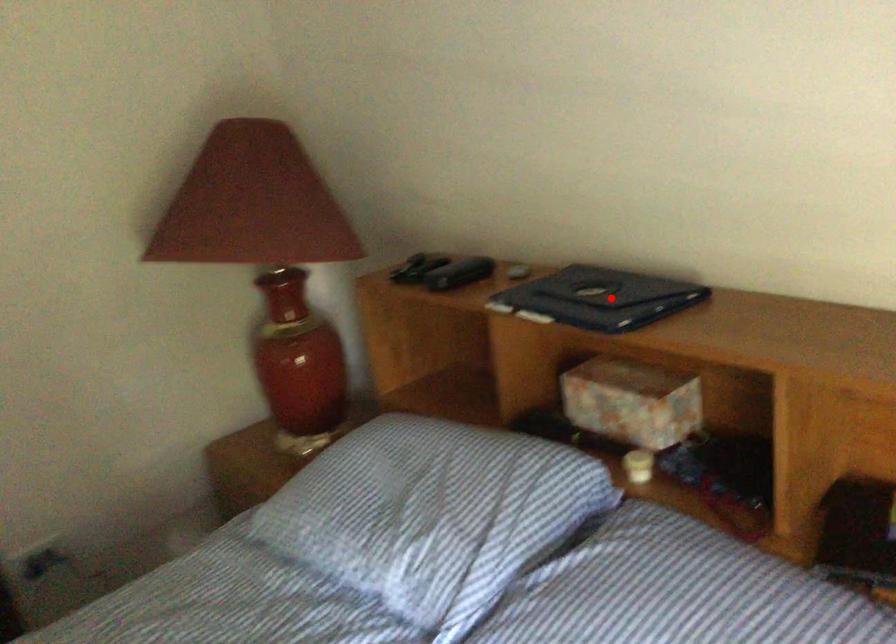
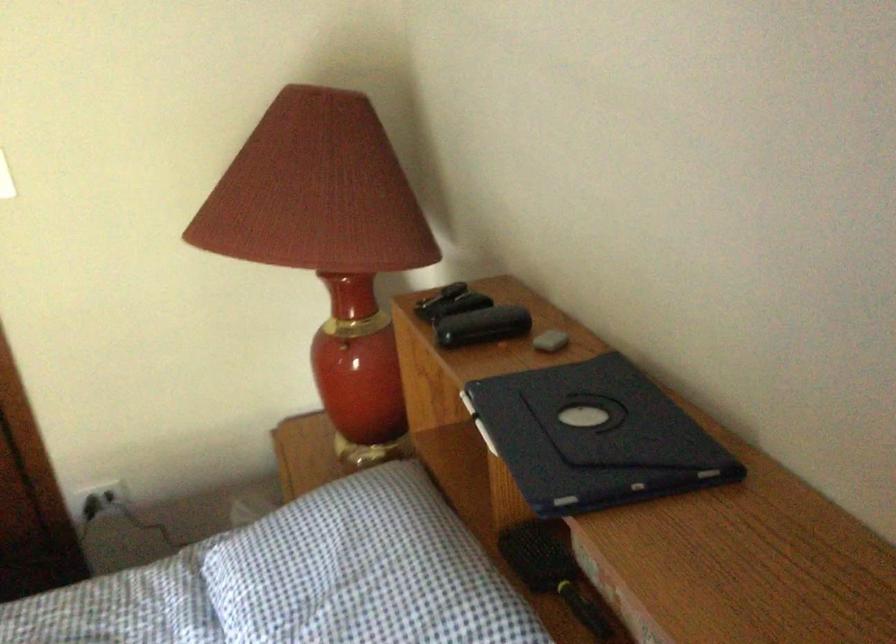
Locate, in the second image, the point that corresponds to the highlighted location in the first image.

(593, 437)